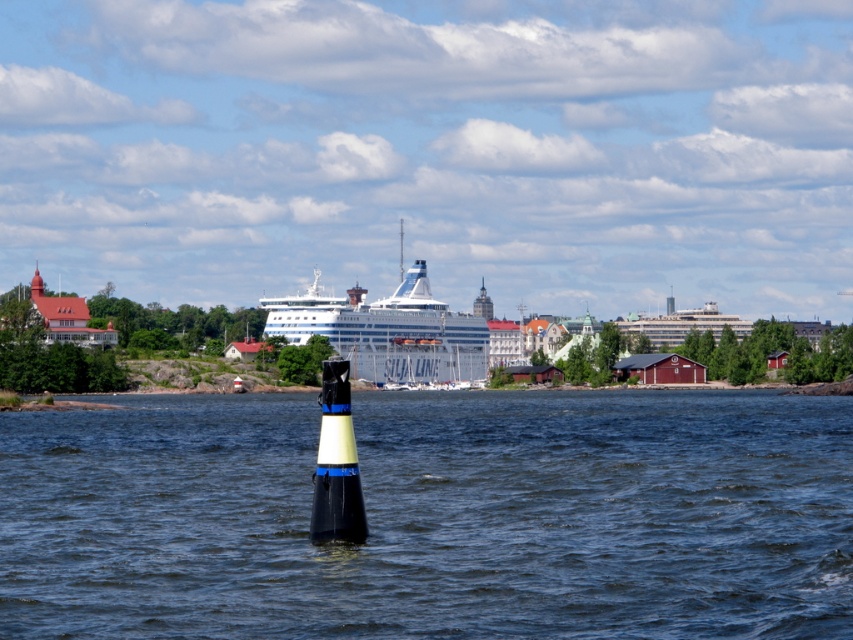
You are a sailor navigating a small boat through the marina. You see the black rubber buoy at center and the white glossy cruise ship at center. Which object is positioned more to the east?

The black rubber buoy at center is to the right of the white glossy cruise ship at center, so if the cruise ship is facing east, the buoy would be positioned more to the east.